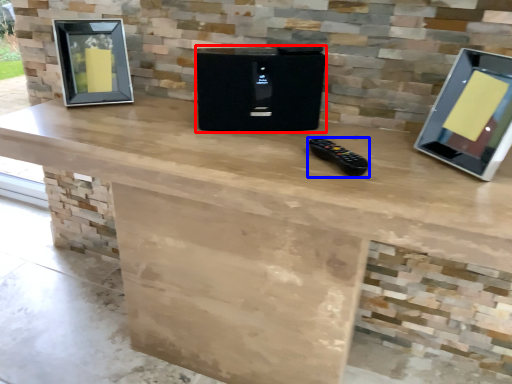
Question: Which point is further to the camera, appliance (highlighted by a red box) or game controller (highlighted by a blue box)?

Choices:
 (A) appliance
 (B) game controller

Answer: (A)